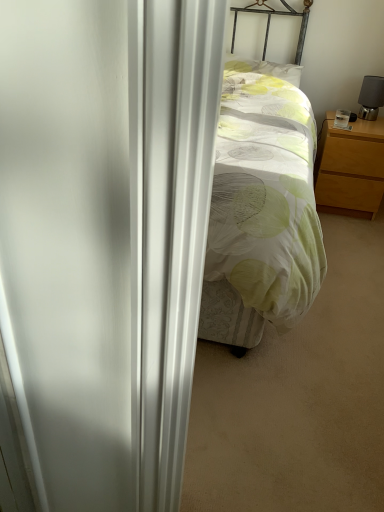
Question: Is light wood/finish nightstand at right to the right of black matte table lamp at right from the viewer's perspective?

Choices:
 (A) no
 (B) yes

Answer: (A)

Question: Is light wood/finish nightstand at right shorter than black matte table lamp at right?

Choices:
 (A) no
 (B) yes

Answer: (A)

Question: Is black matte table lamp at right inside light wood/finish nightstand at right?

Choices:
 (A) yes
 (B) no

Answer: (B)

Question: Is the depth of light wood/finish nightstand at right less than that of black matte table lamp at right?

Choices:
 (A) no
 (B) yes

Answer: (B)

Question: Is light wood/finish nightstand at right thinner than black matte table lamp at right?

Choices:
 (A) no
 (B) yes

Answer: (A)

Question: From a real-world perspective, is light wood/finish nightstand at right positioned under black matte table lamp at right based on gravity?

Choices:
 (A) yes
 (B) no

Answer: (A)

Question: Considering the relative sizes of light green fabric pillow at center and black matte table lamp at right in the image provided, is light green fabric pillow at center taller than black matte table lamp at right?

Choices:
 (A) no
 (B) yes

Answer: (A)

Question: Does light green fabric pillow at center have a greater width compared to black matte table lamp at right?

Choices:
 (A) no
 (B) yes

Answer: (B)

Question: Considering the relative sizes of light green fabric pillow at center and black matte table lamp at right in the image provided, is light green fabric pillow at center bigger than black matte table lamp at right?

Choices:
 (A) yes
 (B) no

Answer: (A)

Question: Does light green fabric pillow at center have a lesser width compared to black matte table lamp at right?

Choices:
 (A) yes
 (B) no

Answer: (B)

Question: Is light green fabric pillow at center not near black matte table lamp at right?

Choices:
 (A) yes
 (B) no

Answer: (B)

Question: Is light green fabric pillow at center facing towards black matte table lamp at right?

Choices:
 (A) yes
 (B) no

Answer: (B)

Question: Does black matte table lamp at right appear on the left side of light wood/finish nightstand at right?

Choices:
 (A) yes
 (B) no

Answer: (B)